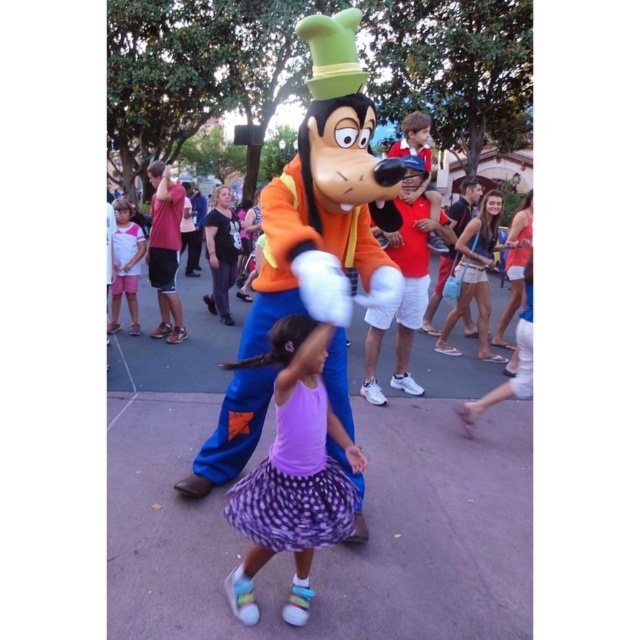
You are a photographer trying to capture a photo of the matte orange costume at center and the light brown denim shorts at upper right. You want to ensure both are in focus. Which object should you adjust your camera focus on first to account for their sizes?

The matte orange costume at center is wider than the light brown denim shorts at upper right, so you should focus on the matte orange costume at center first as it is larger and requires more attention to capture details properly.

You are at the event and want to take a photo of the white cotton shirt at left without the matte orange costume at center blocking it. How can you adjust your position to achieve this?

Move to the side so that the white cotton shirt at left is no longer behind the matte orange costume at center.

You are organizing a parade and need to arrange the matte orange costume at center and the light brown denim shorts at upper right in a line so that the smaller one is in front. Which object should be placed first in the line?

The light brown denim shorts at upper right should be placed first in the line since it is smaller than the matte orange costume at center.